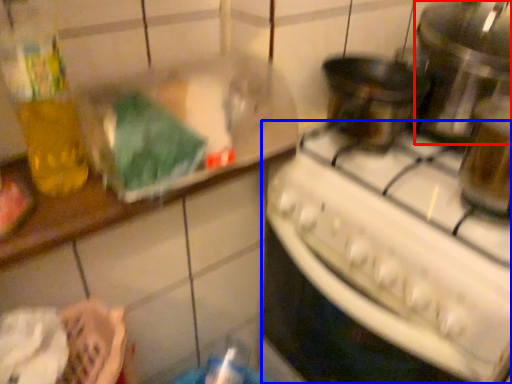
Question: Which point is further to the camera, appliance (highlighted by a red box) or kitchen appliance (highlighted by a blue box)?

Choices:
 (A) appliance
 (B) kitchen appliance

Answer: (A)